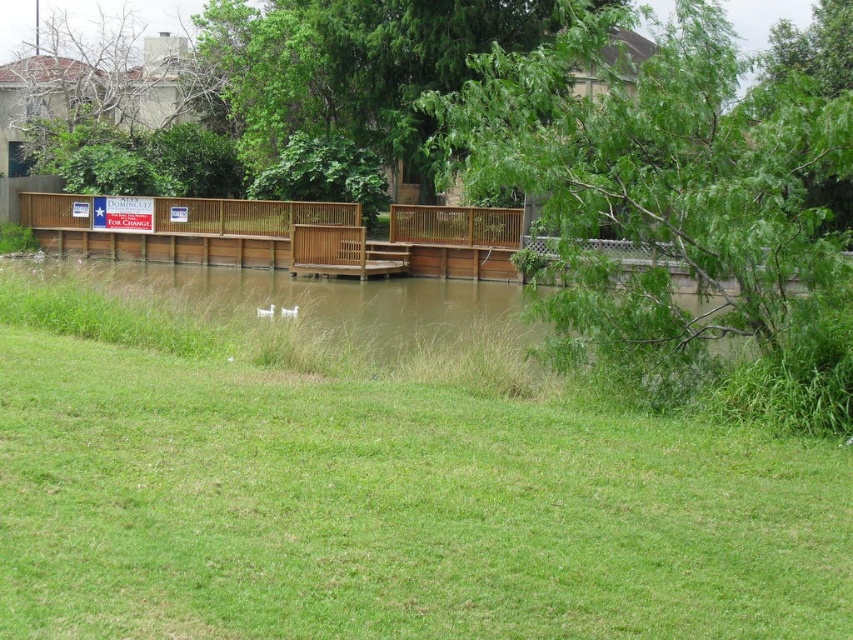
Does green grass at center appear on the left side of green leafy tree at upper right?

Yes, green grass at center is to the left of green leafy tree at upper right.

Based on the photo, who is more distant from viewer, (450, 387) or (764, 92)?

Positioned behind is point (450, 387).

Image resolution: width=853 pixels, height=640 pixels. What are the coordinates of `green grass at center` in the screenshot? It's located at click(x=374, y=474).

Locate an element on the screen. The image size is (853, 640). green grass at center is located at coordinates (374, 474).

The width and height of the screenshot is (853, 640). What do you see at coordinates (659, 184) in the screenshot? I see `green leafy tree at upper right` at bounding box center [659, 184].

The width and height of the screenshot is (853, 640). Identify the location of green leafy tree at upper right. (659, 184).

I want to click on green leafy tree at upper right, so click(x=659, y=184).

Is green grass at center wider than green leafy tree at upper center?

Yes.

How much distance is there between green grass at center and green leafy tree at upper center?

They are 10.90 meters apart.

The image size is (853, 640). Describe the element at coordinates (374, 474) in the screenshot. I see `green grass at center` at that location.

At what (x,y) coordinates should I click in order to perform the action: click on green grass at center. Please return your answer as a coordinate pair (x, y). Looking at the image, I should click on (374, 474).